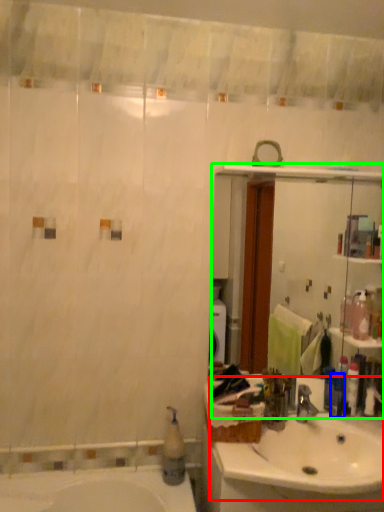
Question: Estimate the real-world distances between objects in this image. Which object is closer to sink (highlighted by a red box), toiletry (highlighted by a blue box) or mirror (highlighted by a green box)?

Choices:
 (A) toiletry
 (B) mirror

Answer: (A)